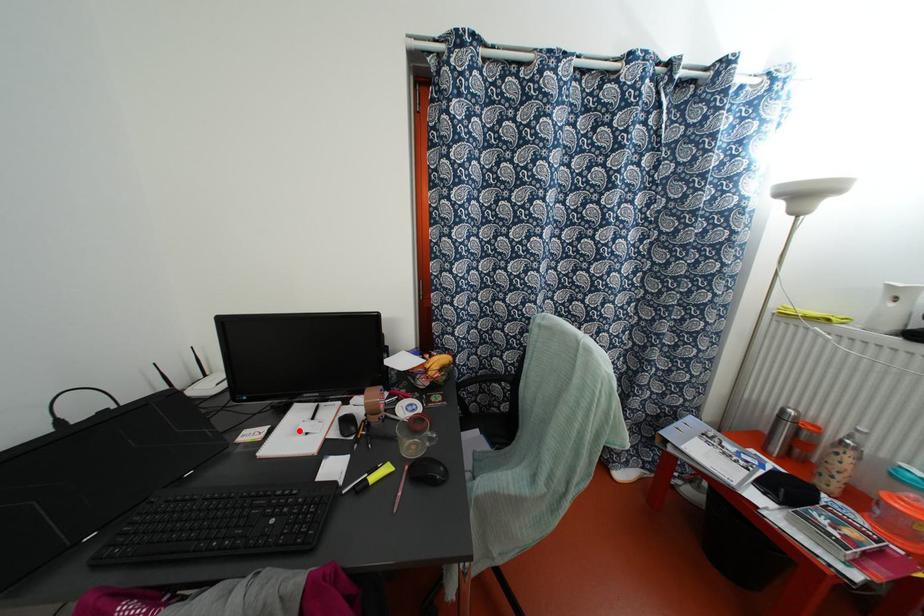
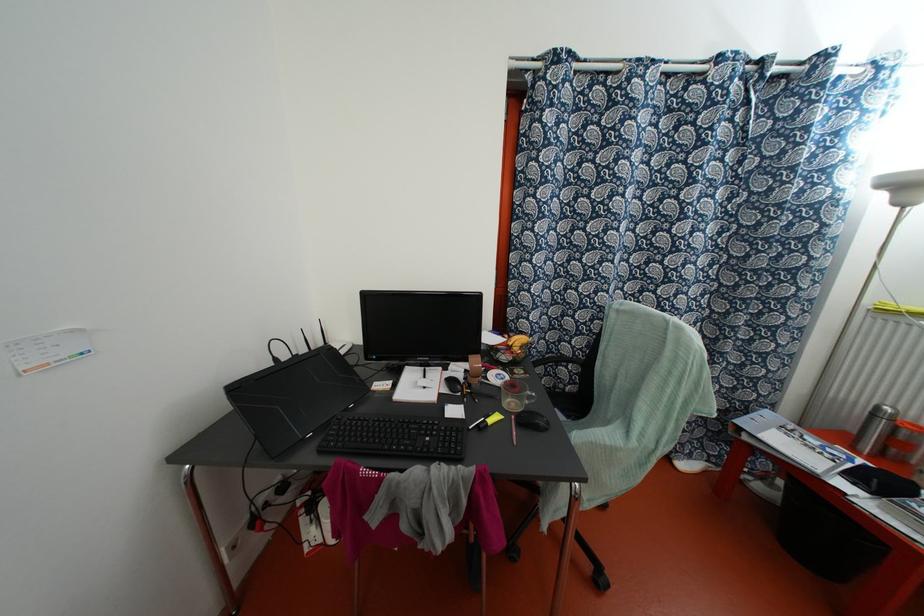
Where in the second image is the point corresponding to the highlighted location from the first image?

(418, 386)